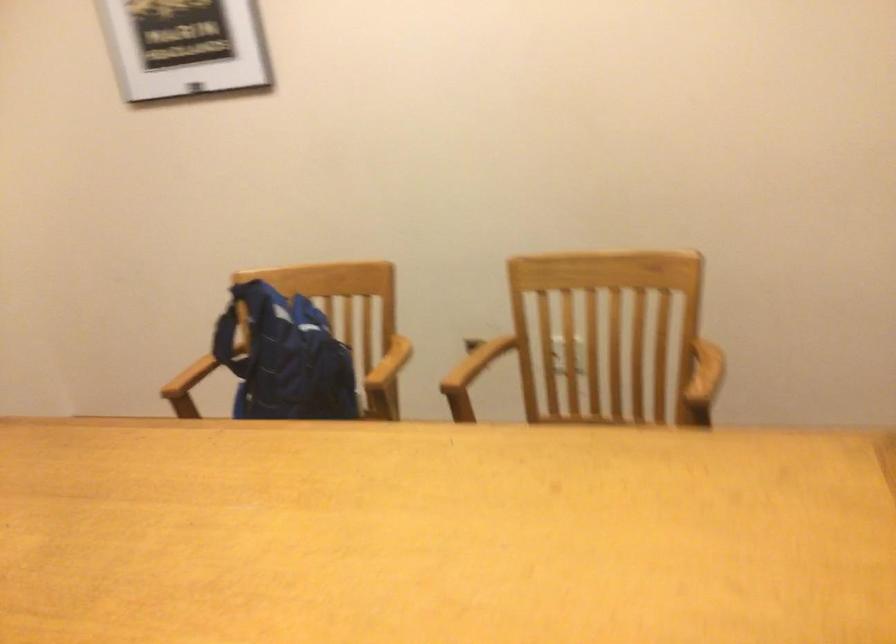
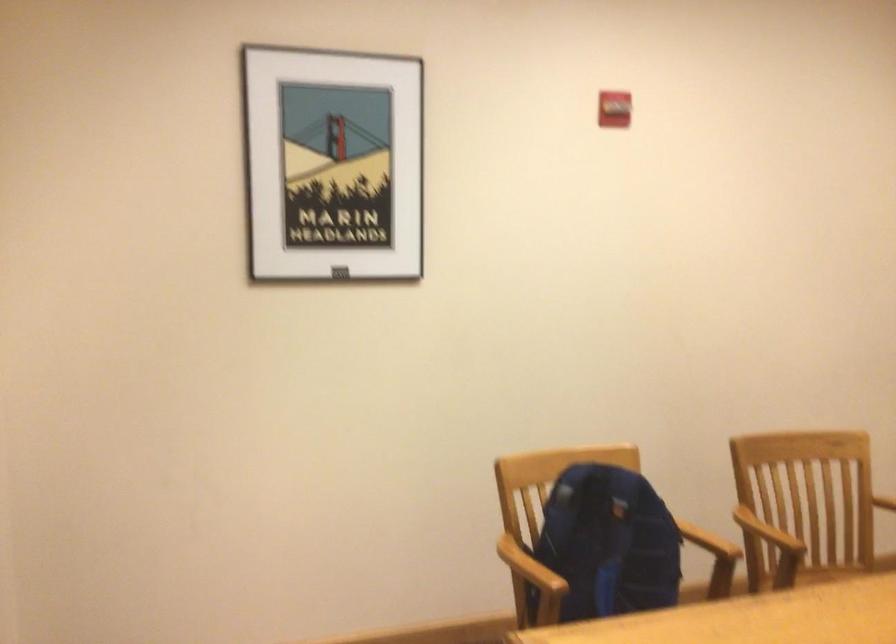
Where in the second image is the point corresponding to (205,368) from the first image?

(530, 567)